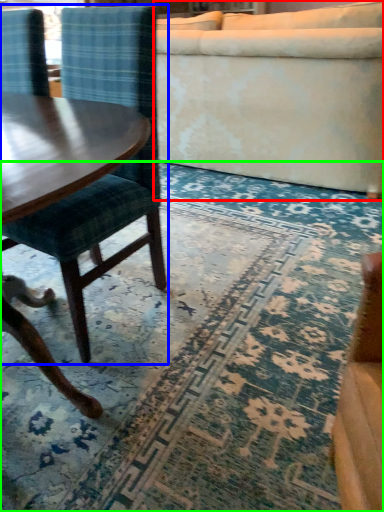
Question: Which object is positioned farthest from studio couch (highlighted by a red box)? Select from chair (highlighted by a blue box) and mat (highlighted by a green box).

Choices:
 (A) chair
 (B) mat

Answer: (A)